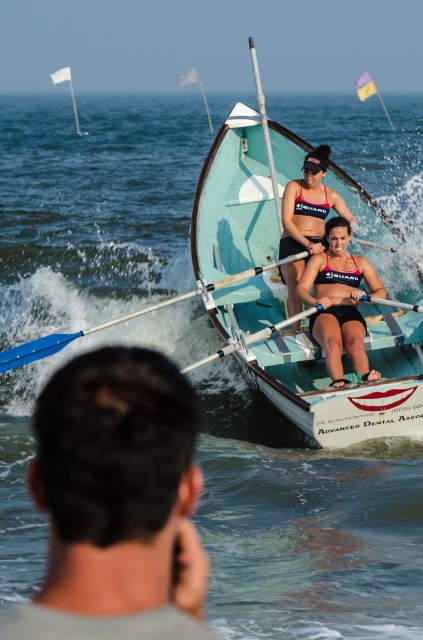
Question: Based on their relative distances, which object is nearer to the dark brown hair at lower left?

Choices:
 (A) white glossy canoe at center
 (B) matte black rowing scull at center

Answer: (B)

Question: Is dark brown hair at lower left positioned behind white glossy canoe at center?

Choices:
 (A) yes
 (B) no

Answer: (B)

Question: Which of the following is the closest to the observer?

Choices:
 (A) (340, 257)
 (B) (320, 212)

Answer: (A)

Question: Does white glossy canoe at center have a lesser width compared to matte black swimsuit at center?

Choices:
 (A) no
 (B) yes

Answer: (A)

Question: Which object is positioned farthest from the matte black swimsuit at center?

Choices:
 (A) matte black rowing scull at center
 (B) matte black bikini top at center

Answer: (A)

Question: Can you confirm if matte black swimsuit at center is positioned above matte black bikini top at center?

Choices:
 (A) yes
 (B) no

Answer: (A)